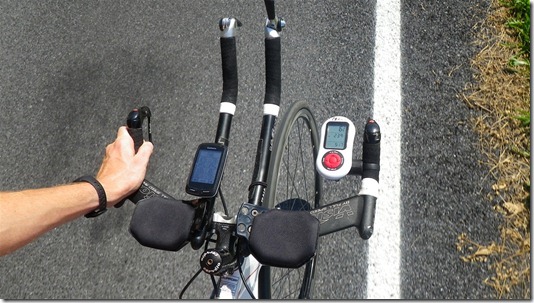
Find the location of `handles`. handles is located at coordinates (372, 174), (274, 81), (227, 70), (137, 133).